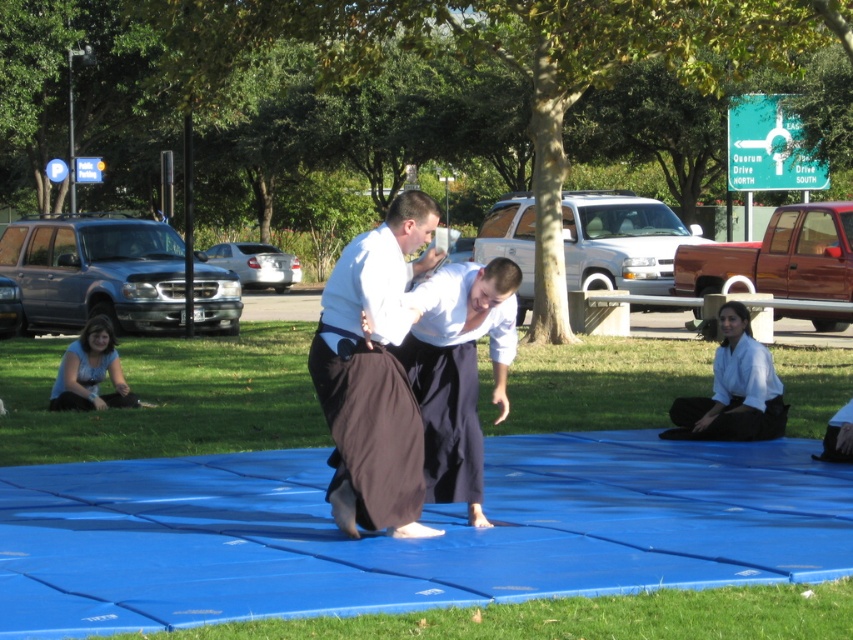
You are a photographer trying to capture a photo of the dark brown fabric kimono at center and the blue fabric at lower left. Which object should you focus on first if you want to ensure both are in focus without adjusting your camera settings?

The dark brown fabric kimono at center has a lesser height compared to blue fabric at lower left, so you should focus on the blue fabric at lower left first since it is taller and might require a different focal plane.

You are standing at the point with coordinates point [79,337] and want to walk towards the point with coordinates point [337,516]. Which direction should you face to move directly towards your destination?

You should face forward because point [337,516] is in front of point [79,337] according to the spatial relationship provided.